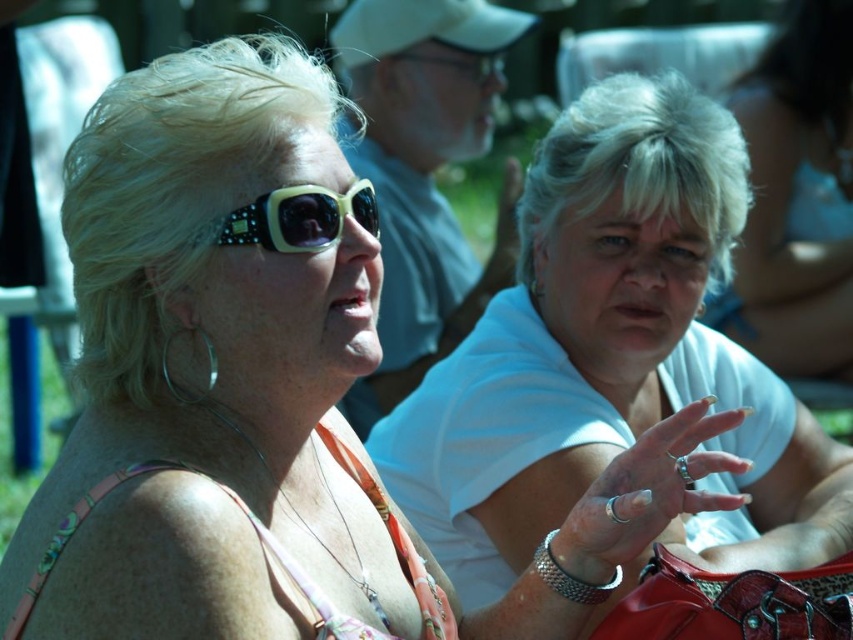
Is white matte shirt at center above matte black sunglasses at upper left?

Actually, white matte shirt at center is below matte black sunglasses at upper left.

Is point (444, 452) closer to viewer compared to point (282, 252)?

No.

Where is `white matte shirt at center`? This screenshot has height=640, width=853. white matte shirt at center is located at coordinates (612, 358).